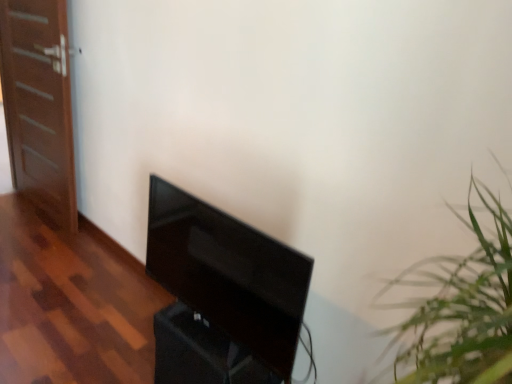
In order to face brown wooden door at left, should I rotate leftwards or rightwards?

It's best to rotate left around 27.342 degrees.

Find the location of a particular element. The width and height of the screenshot is (512, 384). brown wooden door at left is located at coordinates (39, 104).

The image size is (512, 384). What do you see at coordinates (39, 104) in the screenshot?
I see `brown wooden door at left` at bounding box center [39, 104].

Measure the distance between brown wooden door at left and camera.

brown wooden door at left is 7.58 feet from camera.

What do you see at coordinates (221, 294) in the screenshot?
I see `black glossy tv at center` at bounding box center [221, 294].

This screenshot has width=512, height=384. I want to click on black glossy tv at center, so click(x=221, y=294).

This screenshot has height=384, width=512. I want to click on brown wooden door at left, so click(x=39, y=104).

In the scene shown: Is black glossy tv at center to the left of brown wooden door at left from the viewer's perspective?

In fact, black glossy tv at center is to the right of brown wooden door at left.

Considering their positions, is black glossy tv at center located in front of or behind brown wooden door at left?

Clearly, black glossy tv at center is in front of brown wooden door at left.

Which is less distant, (x=249, y=301) or (x=47, y=193)?

Point (x=249, y=301).

From the image's perspective, is black glossy tv at center over brown wooden door at left?

Actually, black glossy tv at center appears below brown wooden door at left in the image.

From a real-world perspective, is black glossy tv at center below brown wooden door at left?

Yes.

Can you confirm if black glossy tv at center is wider than brown wooden door at left?

Indeed, black glossy tv at center has a greater width compared to brown wooden door at left.

Considering the sizes of objects black glossy tv at center and brown wooden door at left in the image provided, who is taller, black glossy tv at center or brown wooden door at left?

brown wooden door at left.

In terms of size, does black glossy tv at center appear bigger or smaller than brown wooden door at left?

Considering their sizes, black glossy tv at center takes up less space than brown wooden door at left.

From the picture: Is black glossy tv at center not inside brown wooden door at left?

black glossy tv at center lies outside brown wooden door at left's area.

Is black glossy tv at center not near brown wooden door at left?

Yes, black glossy tv at center is far from brown wooden door at left.

Is black glossy tv at center facing away from brown wooden door at left?

No, brown wooden door at left is not at the back of black glossy tv at center.

How different are the orientations of black glossy tv at center and brown wooden door at left in degrees?

They differ by 1.87 degrees in their facing directions.

Measure the distance between black glossy tv at center and brown wooden door at left.

1.62 meters.

I want to click on door above the black glossy tv at center (from the image's perspective), so click(39, 104).

Between brown wooden door at left and black glossy tv at center, which one appears on the left side from the viewer's perspective?

brown wooden door at left.

Which object is more forward, brown wooden door at left or black glossy tv at center?

black glossy tv at center is in front.

Considering the points (6, 73) and (159, 263), which point is behind, point (6, 73) or point (159, 263)?

Positioned behind is point (6, 73).

From the image's perspective, who appears lower, brown wooden door at left or black glossy tv at center?

From the image's view, black glossy tv at center is below.

From a real-world perspective, is brown wooden door at left above or below black glossy tv at center?

From a real-world perspective, brown wooden door at left is physically above black glossy tv at center.

Considering the sizes of objects brown wooden door at left and black glossy tv at center in the image provided, who is thinner, brown wooden door at left or black glossy tv at center?

brown wooden door at left.

Which of these two, brown wooden door at left or black glossy tv at center, stands taller?

brown wooden door at left.

Is brown wooden door at left smaller than black glossy tv at center?

No.

Is brown wooden door at left positioned beyond the bounds of black glossy tv at center?

Yes, brown wooden door at left is not within black glossy tv at center.

Consider the image. Are brown wooden door at left and black glossy tv at center far apart?

brown wooden door at left is positioned a significant distance from black glossy tv at center.

Could you tell me if brown wooden door at left is facing black glossy tv at center?

No, brown wooden door at left is not aimed at black glossy tv at center.

What's the angular difference between brown wooden door at left and black glossy tv at center's facing directions?

1.87 degrees.

How much distance is there between brown wooden door at left and black glossy tv at center?

brown wooden door at left is 5.31 feet away from black glossy tv at center.

The image size is (512, 384). In the image, there is a brown wooden door at left. Identify the location of furniture below it (from a real-world perspective). (221, 294).

Find the location of a particular element. furniture in front of the brown wooden door at left is located at coordinates (221, 294).

You are a GUI agent. You are given a task and a screenshot of the screen. Output one action in this format:
    pyautogui.click(x=<x>, y=<y>)
    Task: Click on the door above the black glossy tv at center (from a real-world perspective)
    
    Given the screenshot: What is the action you would take?
    pyautogui.click(x=39, y=104)